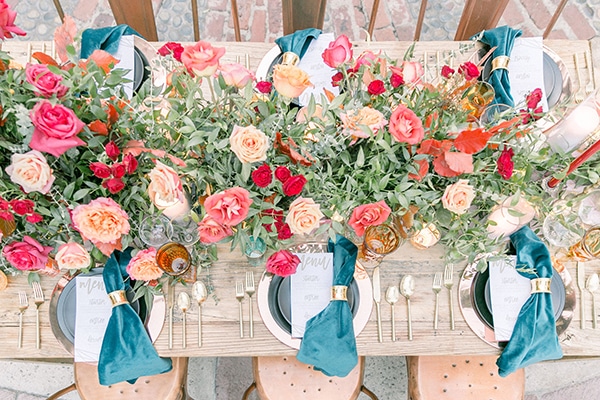
This screenshot has width=600, height=400. I want to click on spoons, so click(x=183, y=320), click(x=200, y=324), click(x=392, y=314), click(x=409, y=315), click(x=591, y=306).